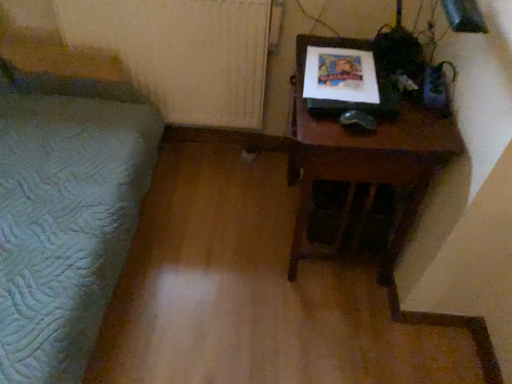
Locate an element on the screen. empty space that is ontop of wooden table at right (from a real-world perspective) is located at coordinates (383, 98).